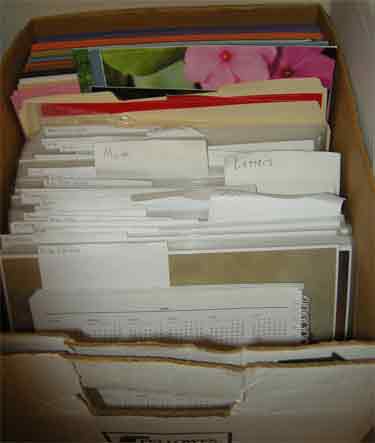
You are a GUI agent. You are given a task and a screenshot of the screen. Output one action in this format:
    pyautogui.click(x=<x>, y=<y>)
    Task: Click on the red file folder
    
    Given the screenshot: What is the action you would take?
    pyautogui.click(x=177, y=102)